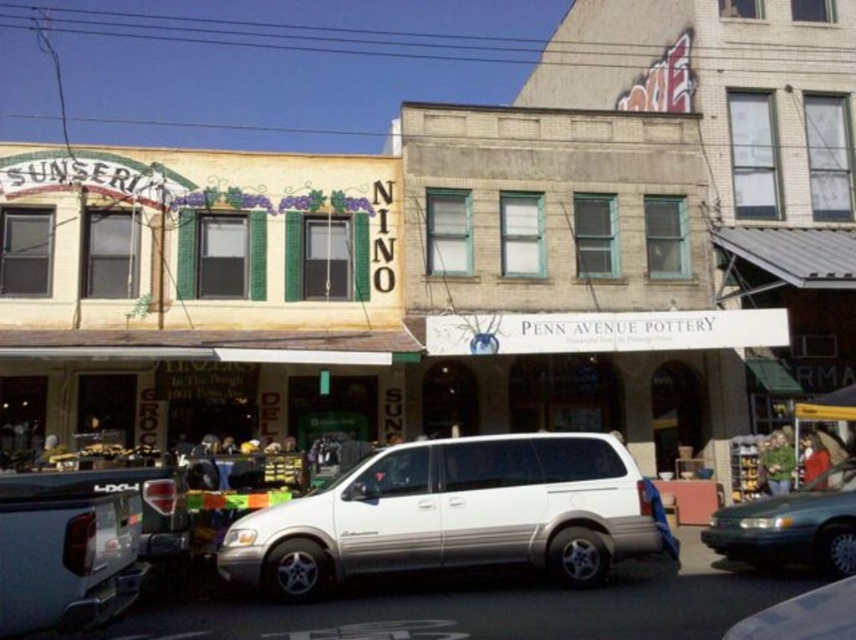
You are a delivery person needing to park your vehicle in this street scene. You have a silver metallic suv at lower left and a metallic silver van at center. Which vehicle takes up more space horizontally?

The silver metallic suv at lower left is wider than the metallic silver van at center, so it takes up more horizontal space.

You are standing on the street looking at the two buildings. There are two points marked on the buildings. The first point is at coordinate point (123, 608) and the second is at point (819, 508). Which point is closer to you?

Point (123, 608) is closer to the viewer than point (819, 508).

Based on the photo, you are standing on the sidewalk in front of the two buildings. You see two points marked on the buildings. The first point is at coordinate point (456, 547) and the second is at point (51, 600). Which point is closer to you?

Point (51, 600) is closer to you because it is nearer to the camera than point (456, 547).